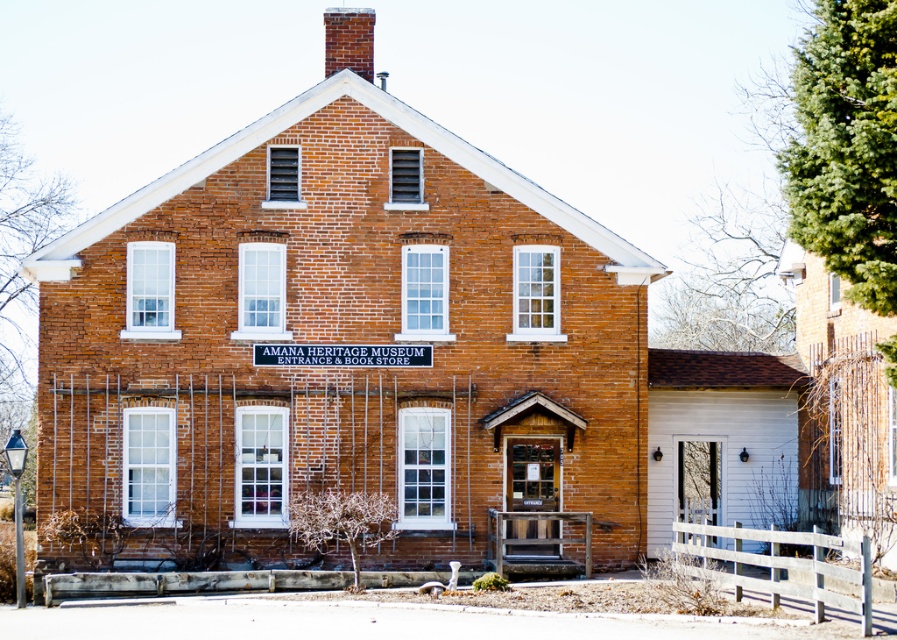
Question: Does smooth brick chimney at center top come behind red brick chimney at upper center?

Choices:
 (A) no
 (B) yes

Answer: (A)

Question: Which point is closer to the camera taking this photo?

Choices:
 (A) (334, 38)
 (B) (314, 412)

Answer: (B)

Question: Is smooth brick chimney at center top to the right of red brick chimney at upper center from the viewer's perspective?

Choices:
 (A) no
 (B) yes

Answer: (B)

Question: Can you confirm if smooth brick chimney at center top is wider than red brick chimney at upper center?

Choices:
 (A) yes
 (B) no

Answer: (A)

Question: Which object appears closest to the camera in this image?

Choices:
 (A) smooth brick chimney at center top
 (B) red brick chimney at upper center

Answer: (A)